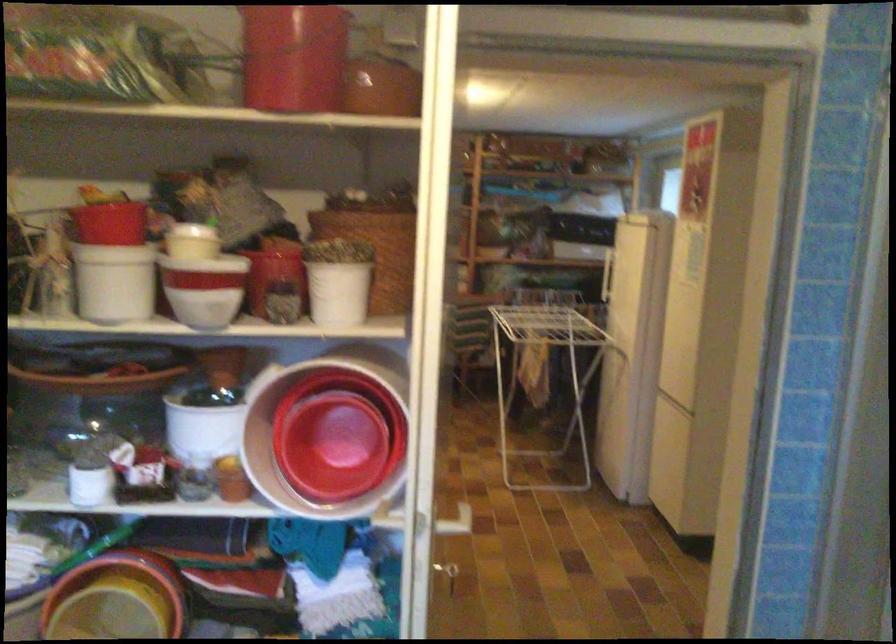
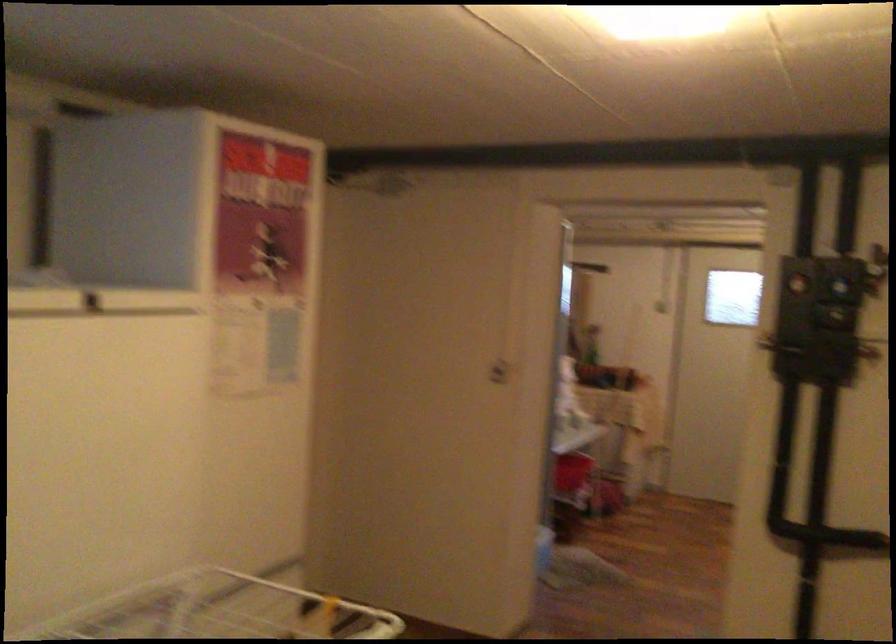
Question: I am providing you with two images of the same scene from different viewpoints. After the viewpoint changes to image2, which objects are now occluded?

Choices:
 (A) activity cube toy
 (B) white door handle
 (C) wicker storage basket
 (D) refrigerator door handle

Answer: (C)